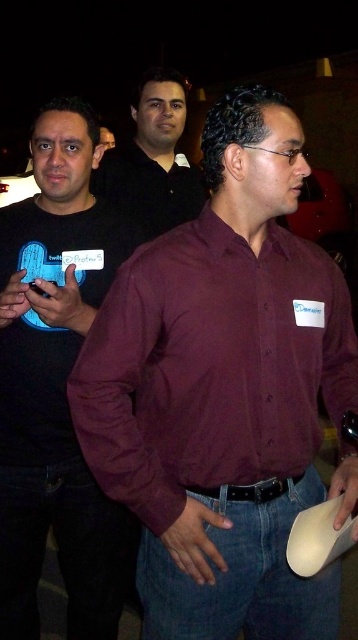
Question: Can you confirm if maroon smooth shirt at center is bigger than matte black shirt at left?

Choices:
 (A) no
 (B) yes

Answer: (A)

Question: Can you confirm if maroon smooth shirt at center is positioned above matte black shirt at left?

Choices:
 (A) no
 (B) yes

Answer: (B)

Question: Which object appears closest to the camera in this image?

Choices:
 (A) maroon smooth shirt at center
 (B) matte black shirt at center
 (C) matte black shirt at left

Answer: (A)

Question: Which object appears farthest from the camera in this image?

Choices:
 (A) maroon smooth shirt at center
 (B) matte black shirt at center
 (C) matte black shirt at left

Answer: (B)

Question: Which of these objects is positioned closest to the matte black shirt at center?

Choices:
 (A) maroon smooth shirt at center
 (B) matte black shirt at left

Answer: (B)

Question: Can you confirm if matte black shirt at left is positioned above matte black shirt at center?

Choices:
 (A) no
 (B) yes

Answer: (A)